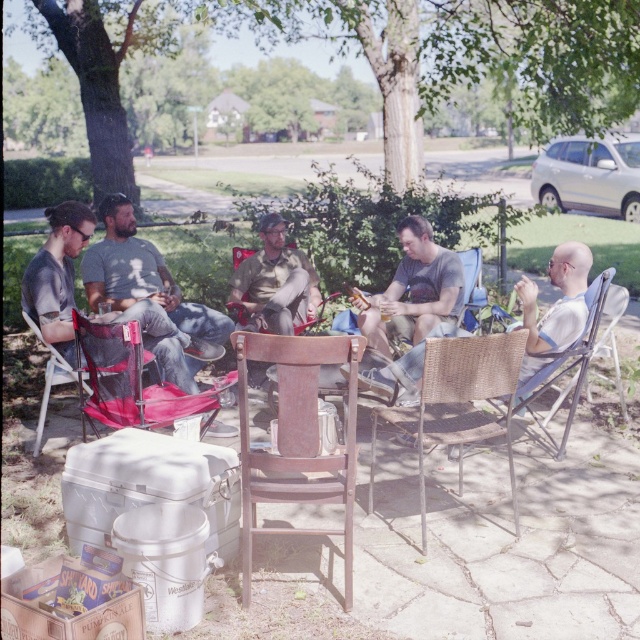
Is green leafy tree at upper center wider than matte red folding chair at lower left?

Correct, the width of green leafy tree at upper center exceeds that of matte red folding chair at lower left.

Between point (572, 122) and point (108, 332), which one is positioned behind?

Positioned behind is point (572, 122).

The width and height of the screenshot is (640, 640). Identify the location of green leafy tree at upper center. (381, 58).

Between white plastic cooler at lower left and wicker chair at center, which one has less height?

With less height is white plastic cooler at lower left.

What do you see at coordinates (148, 484) in the screenshot? The height and width of the screenshot is (640, 640). I see `white plastic cooler at lower left` at bounding box center [148, 484].

The image size is (640, 640). What are the coordinates of `white plastic cooler at lower left` in the screenshot? It's located at (148, 484).

Between wicker chair at lower right and wicker chair at center, which one has more height?

wicker chair at lower right is taller.

Is wicker chair at lower right below wicker chair at center?

Indeed, wicker chair at lower right is positioned under wicker chair at center.

Which is behind, point (525, 401) or point (464, 316)?

Point (464, 316)

Find the location of a particular element. The image size is (640, 640). wicker chair at lower right is located at coordinates (580, 346).